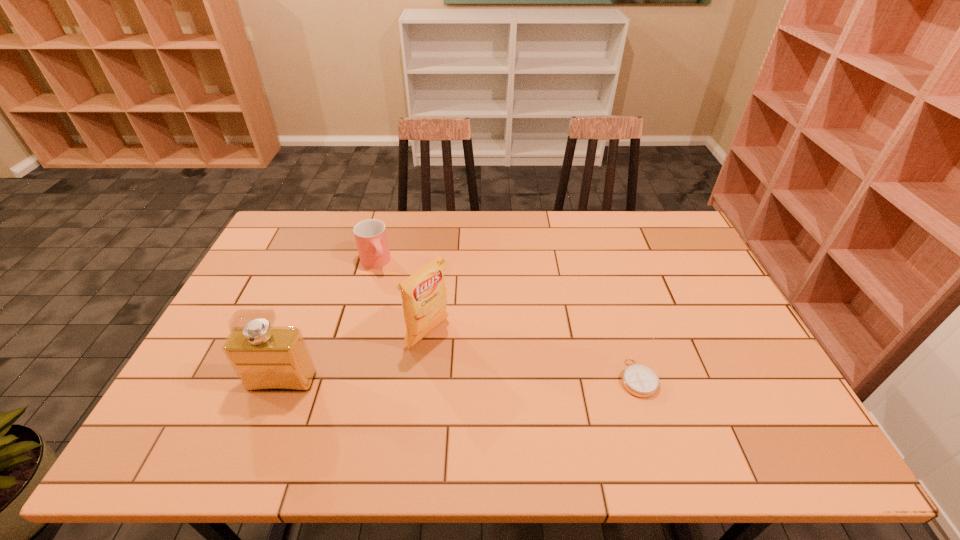
The image size is (960, 540). I want to click on free space on the desktop that is between the leftmost object and the shortest object and is positioned on the side of the cup with the handle, so tap(444, 380).

Find the location of a particular element. free spot on the desktop that is between the perfume and the shortest object and is positioned on the front of the third object from left to right with the logo is located at coordinates (494, 380).